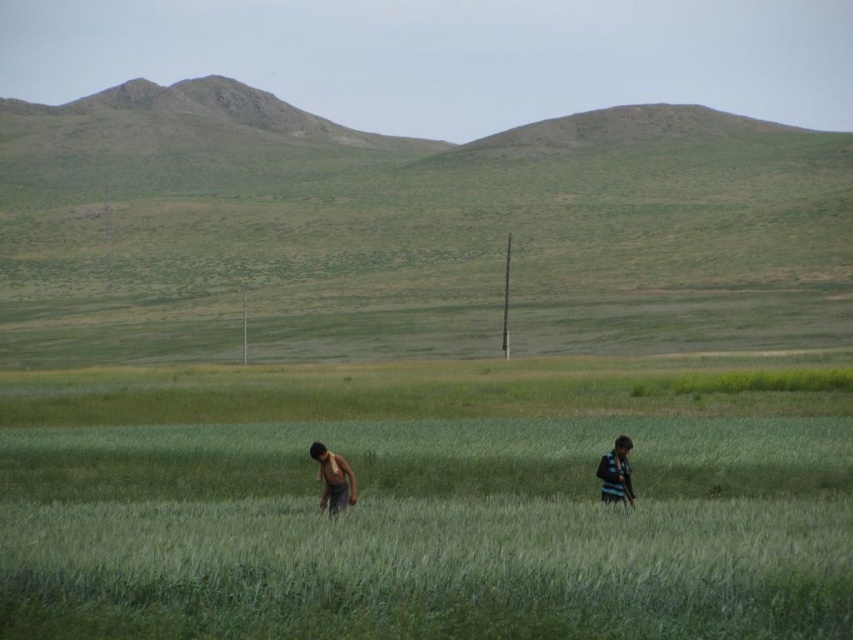
Question: Which object is farther from the camera taking this photo?

Choices:
 (A) striped fabric shirt at right
 (B) dark green shirt at center
 (C) dark brown shirt at center

Answer: (A)

Question: Is dark brown shirt at center thinner than striped fabric shirt at right?

Choices:
 (A) no
 (B) yes

Answer: (A)

Question: Is dark green shirt at center bigger than dark brown shirt at center?

Choices:
 (A) yes
 (B) no

Answer: (A)

Question: In this image, where is dark green shirt at center located relative to striped fabric shirt at right?

Choices:
 (A) right
 (B) left

Answer: (B)

Question: Which point appears farthest from the camera in this image?

Choices:
 (A) (331, 493)
 (B) (616, 451)

Answer: (B)

Question: Which of the following is the closest to the observer?

Choices:
 (A) striped fabric shirt at right
 (B) dark brown shirt at center
 (C) dark green shirt at center

Answer: (C)